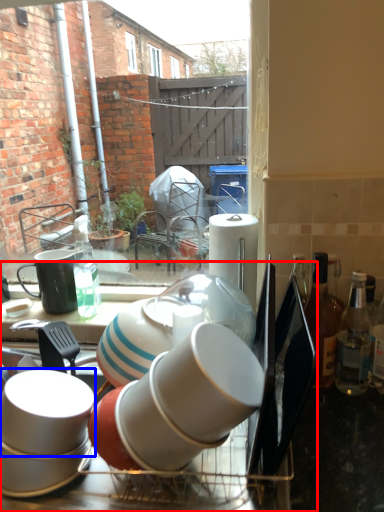
Question: Which point is further to the camera, dish washer (highlighted by a red box) or coffee cup (highlighted by a blue box)?

Choices:
 (A) dish washer
 (B) coffee cup

Answer: (B)